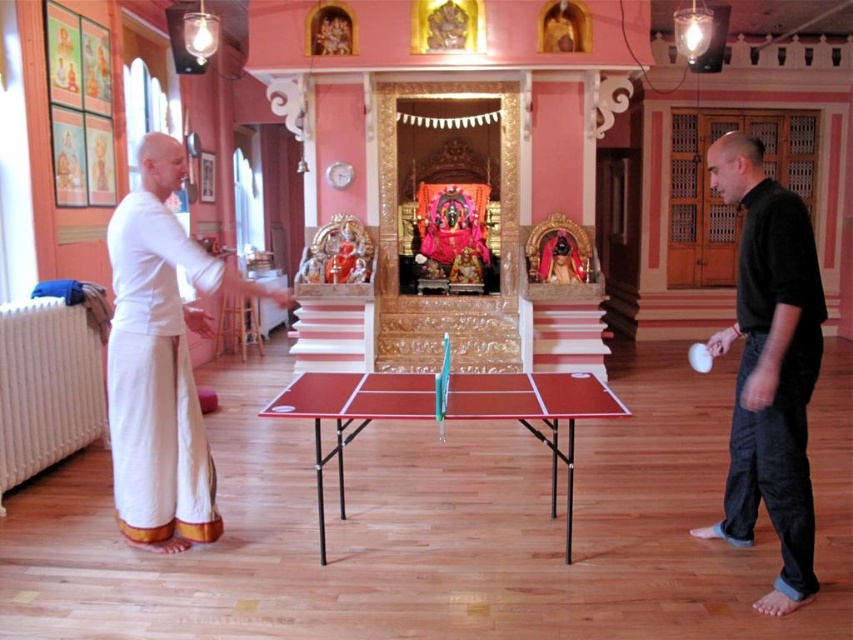
Question: Among these objects, which one is farthest from the camera?

Choices:
 (A) black cotton shirt at right
 (B) red plastic table at center
 (C) white rubber table tennis ball at center
 (D) white cotton robe at left

Answer: (C)

Question: Which point is farther to the camera?

Choices:
 (A) (791, 268)
 (B) (293, 400)

Answer: (B)

Question: Can you confirm if white cotton robe at left is positioned below white rubber table tennis ball at center?

Choices:
 (A) yes
 (B) no

Answer: (B)

Question: Can you confirm if white cotton robe at left is positioned to the right of red plastic table at center?

Choices:
 (A) yes
 (B) no

Answer: (B)

Question: Which point appears closest to the camera in this image?

Choices:
 (A) (699, 342)
 (B) (786, 435)
 (C) (555, 380)

Answer: (B)

Question: Can you confirm if white cotton robe at left is thinner than white rubber table tennis ball at center?

Choices:
 (A) no
 (B) yes

Answer: (B)